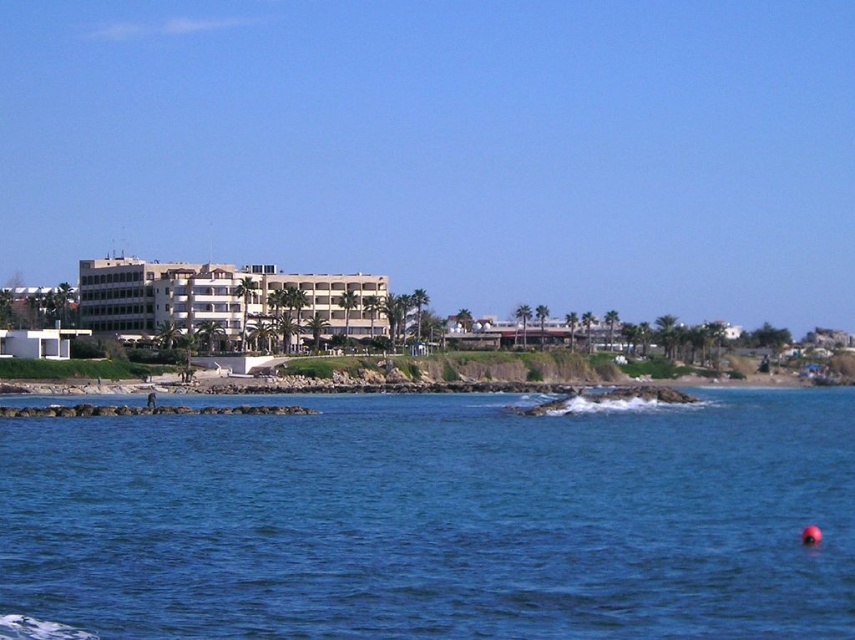
Question: Which of the following is the farthest from the observer?

Choices:
 (A) white matte building at center
 (B) blue water at center

Answer: (A)

Question: Is blue water at center wider than white matte building at center?

Choices:
 (A) yes
 (B) no

Answer: (B)

Question: Can you confirm if blue water at center is bigger than white matte building at center?

Choices:
 (A) yes
 (B) no

Answer: (B)

Question: Which of the following is the farthest from the observer?

Choices:
 (A) blue water at center
 (B) white matte building at center

Answer: (B)

Question: Can you confirm if blue water at center is wider than white matte building at center?

Choices:
 (A) no
 (B) yes

Answer: (A)